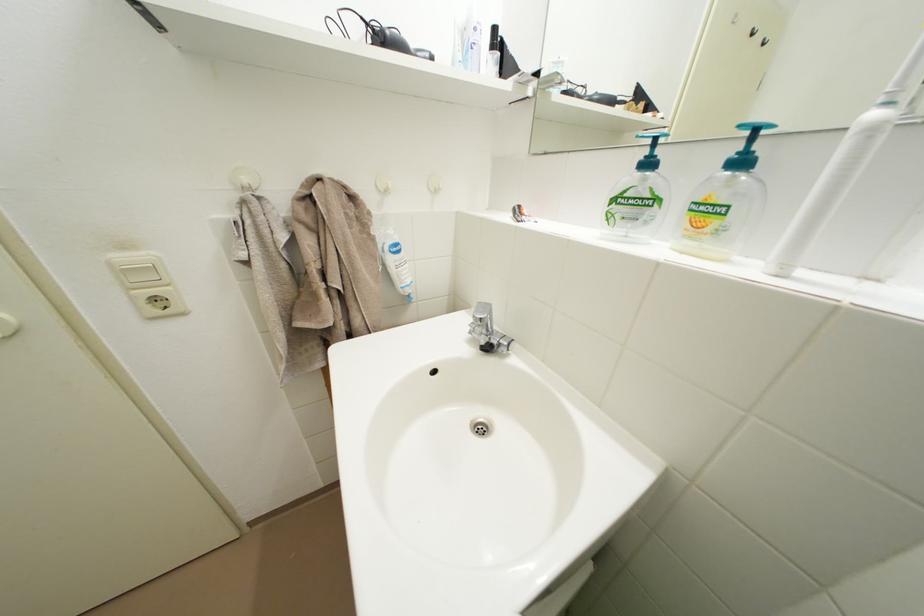
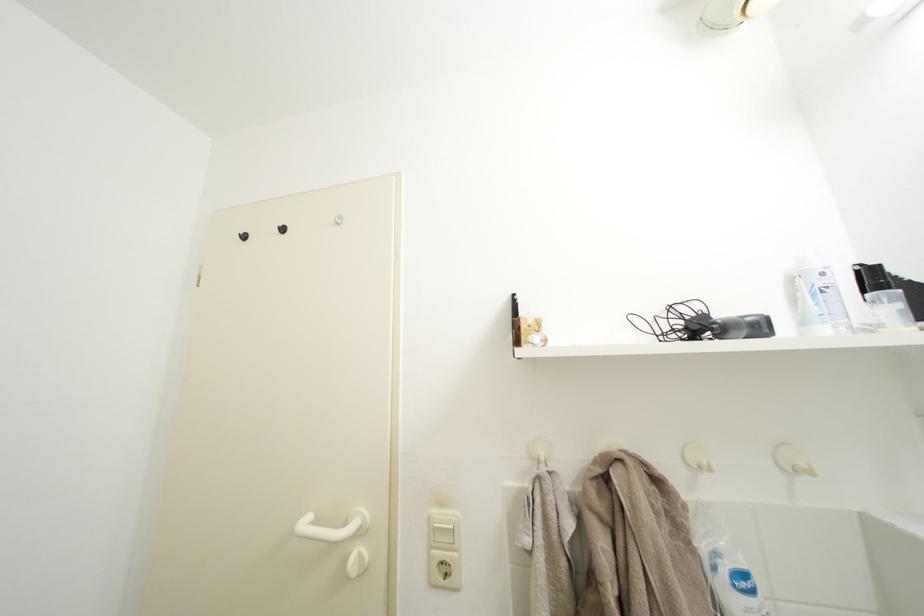
In the second image, find the point that corresponds to point 140,304 in the first image.

(439, 562)